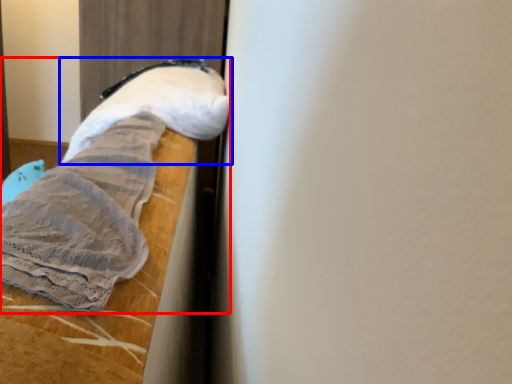
Question: Which point is further to the camera, sheet (highlighted by a red box) or footwear (highlighted by a blue box)?

Choices:
 (A) sheet
 (B) footwear

Answer: (B)